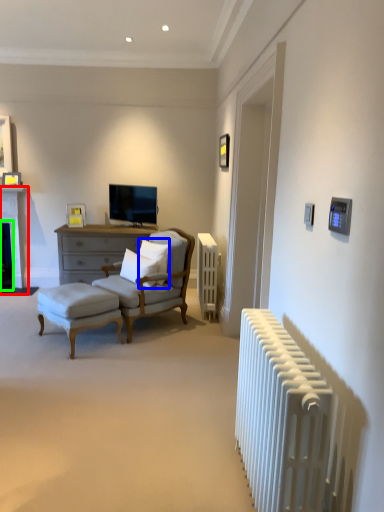
Question: Based on their relative distances, which object is farther from fireplace (highlighted by a red box)? Choose from pillow (highlighted by a blue box) and fireplace (highlighted by a green box).

Choices:
 (A) pillow
 (B) fireplace

Answer: (A)